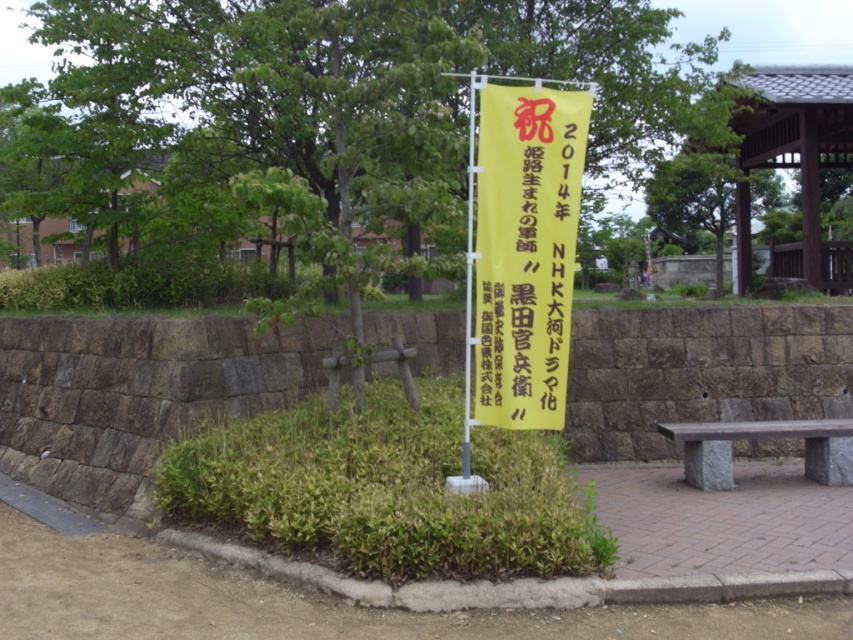
Question: Is green leafy tree at center thinner than yellow paper banner at center?

Choices:
 (A) no
 (B) yes

Answer: (A)

Question: Is green leafy tree at center bigger than yellow paper banner at center?

Choices:
 (A) no
 (B) yes

Answer: (B)

Question: Which of the following is the closest to the observer?

Choices:
 (A) yellow paper banner at center
 (B) wooden bench at right

Answer: (A)

Question: Which is farther from the green leafy tree at center?

Choices:
 (A) yellow paper banner at center
 (B) wooden bench at right

Answer: (B)

Question: Can you confirm if yellow paper banner at center is positioned below wooden bench at right?

Choices:
 (A) yes
 (B) no

Answer: (B)

Question: Estimate the real-world distances between objects in this image. Which object is closer to the yellow paper banner at center?

Choices:
 (A) wooden bench at right
 (B) green leafy tree at center

Answer: (A)